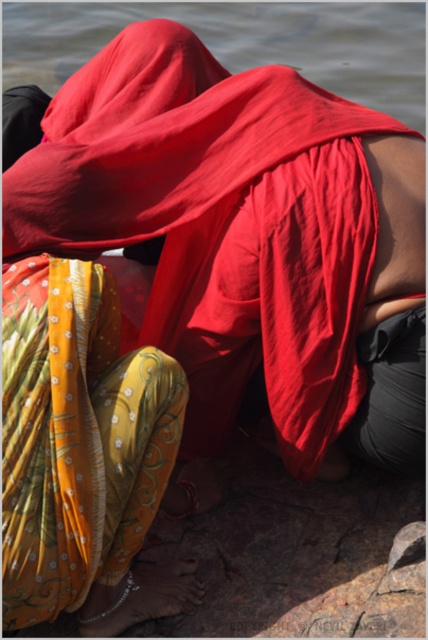
Question: Observing the image, what is the correct spatial positioning of yellow floral fabric at lower left in reference to transparent water at upper center?

Choices:
 (A) below
 (B) above

Answer: (A)

Question: Which point appears farthest from the camera in this image?

Choices:
 (A) (354, 93)
 (B) (350, 337)

Answer: (A)

Question: Which point is closer to the camera?

Choices:
 (A) (228, 266)
 (B) (410, 52)

Answer: (A)

Question: Is yellow floral fabric at lower left positioned at the back of transparent water at upper center?

Choices:
 (A) yes
 (B) no

Answer: (B)

Question: Can you confirm if yellow floral fabric at lower left is positioned below transparent water at upper center?

Choices:
 (A) no
 (B) yes

Answer: (B)

Question: Which point is farther to the camera?

Choices:
 (A) (409, 228)
 (B) (226, 28)

Answer: (B)